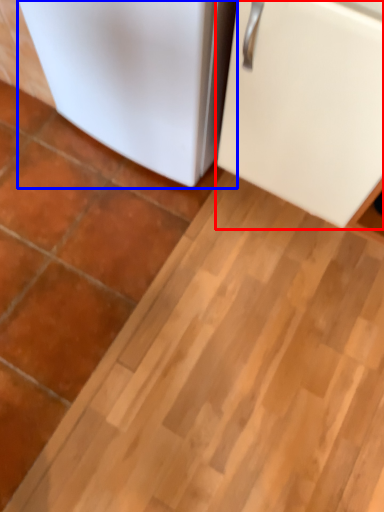
Question: Which object appears farthest to the camera in this image, refrigerator (highlighted by a red box) or refrigerator (highlighted by a blue box)?

Choices:
 (A) refrigerator
 (B) refrigerator

Answer: (B)